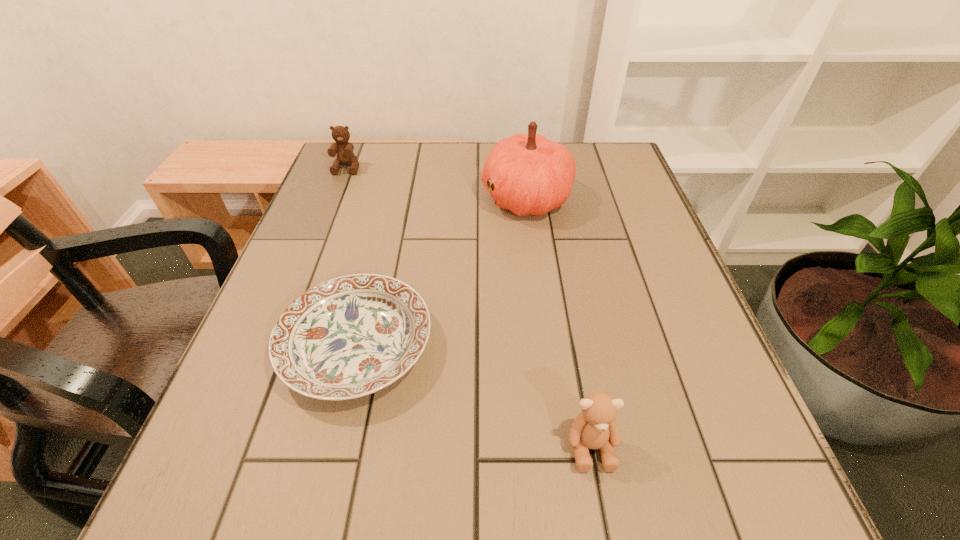
The width and height of the screenshot is (960, 540). What are the coordinates of `vacant area at the far right corner of the desktop` in the screenshot? It's located at (617, 181).

What are the coordinates of `free space between the farther teddy bear and the tallest object` in the screenshot? It's located at (437, 183).

The image size is (960, 540). I want to click on vacant space that is in between the left teddy bear and the nearer teddy bear, so click(x=469, y=307).

I want to click on free spot between the left teddy bear and the plate, so click(x=351, y=257).

What are the coordinates of `vacant area that lies between the right teddy bear and the shortest object` in the screenshot? It's located at (474, 396).

You are a GUI agent. You are given a task and a screenshot of the screen. Output one action in this format:
    pyautogui.click(x=<x>, y=<y>)
    Task: Click on the vacant space that's between the nearer teddy bear and the left teddy bear
    The width and height of the screenshot is (960, 540).
    Given the screenshot: What is the action you would take?
    pyautogui.click(x=469, y=307)

The height and width of the screenshot is (540, 960). In order to click on free space that is in between the plate and the nearest object in this screenshot , I will do `click(474, 396)`.

Locate an element on the screen. The image size is (960, 540). blank region between the pumpkin and the shortest object is located at coordinates (442, 272).

You are a GUI agent. You are given a task and a screenshot of the screen. Output one action in this format:
    pyautogui.click(x=<x>, y=<y>)
    Task: Click on the vacant area that lies between the left teddy bear and the nearer teddy bear
    
    Given the screenshot: What is the action you would take?
    pyautogui.click(x=469, y=307)

Locate an element on the screen. vacant area that lies between the left teddy bear and the pumpkin is located at coordinates (437, 183).